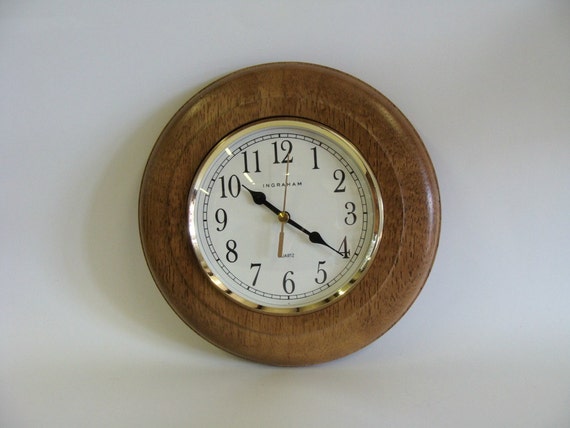
I want to click on wooden frame of clock, so click(408, 176).